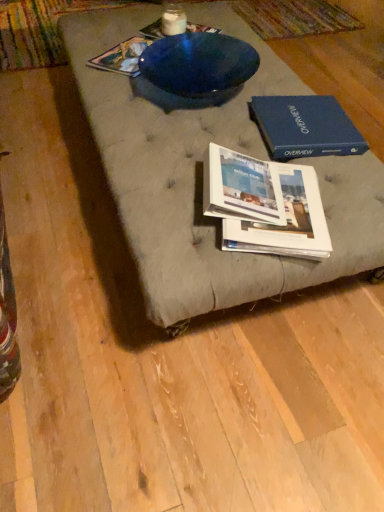
You are a GUI agent. You are given a task and a screenshot of the screen. Output one action in this format:
    pyautogui.click(x=<x>, y=<y>)
    Task: Click on the blank area beneath white glossy book at center, the third book viewed from the top (from a real-world perspective)
    The image size is (384, 512).
    Given the screenshot: What is the action you would take?
    pyautogui.click(x=269, y=190)